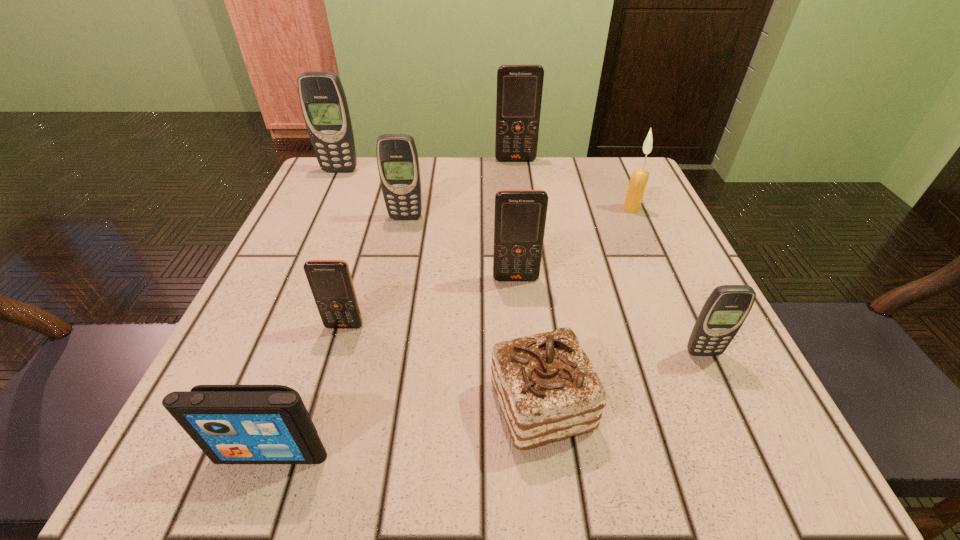
Where is `free space located 0.190m on the back of the candle`? free space located 0.190m on the back of the candle is located at coordinates (611, 161).

You are a GUI agent. You are given a task and a screenshot of the screen. Output one action in this format:
    pyautogui.click(x=<x>, y=<y>)
    Task: Click on the free space located on the screen of the fifth farthest cellular telephone
    The height and width of the screenshot is (540, 960).
    Given the screenshot: What is the action you would take?
    pyautogui.click(x=307, y=454)

Find the location of a particular element. Image resolution: width=960 pixels, height=540 pixels. vacant position located on the screen of the smallest gray cellular telephone is located at coordinates (746, 448).

Identify the location of vacant space located 0.210m on the back of the shortest object. (526, 268).

The image size is (960, 540). Find the location of `candle at the far edge`. candle at the far edge is located at coordinates (639, 177).

At what (x,y) coordinates should I click in order to perform the action: click on iPod situated at the near edge. Please return your answer as a coordinate pair (x, y). The height and width of the screenshot is (540, 960). Looking at the image, I should click on (232, 424).

Identify the location of chocolate cake at the near edge. (547, 388).

Locate an element on the screen. iPod at the left edge is located at coordinates (232, 424).

Find the location of a particular element. This screenshot has height=540, width=960. candle located at the right edge is located at coordinates (639, 177).

At what (x,y) coordinates should I click in order to perform the action: click on cellular telephone at the right edge. Please return your answer as a coordinate pair (x, y). This screenshot has height=540, width=960. Looking at the image, I should click on (727, 307).